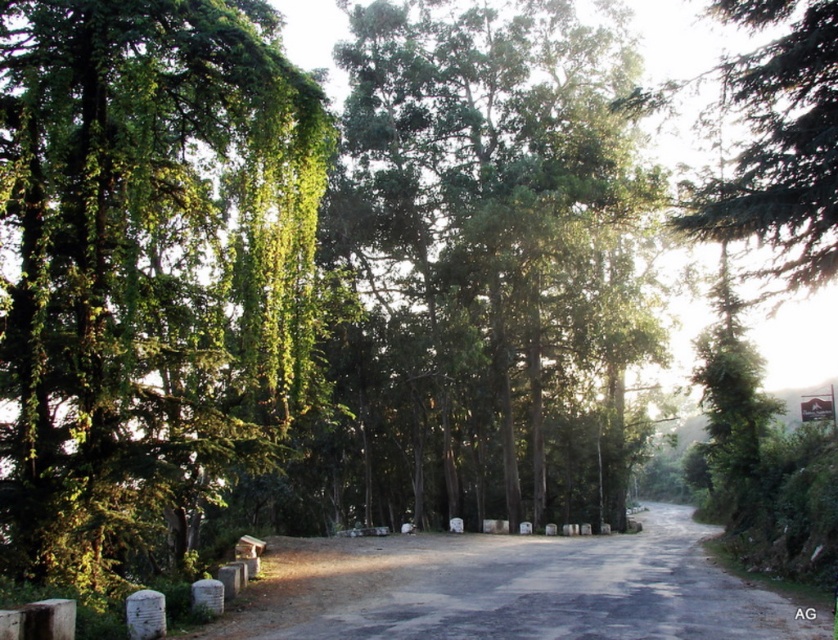
Question: Does green leafy tree at left have a larger size compared to green leafy trees at center?

Choices:
 (A) no
 (B) yes

Answer: (A)

Question: Considering the relative positions of green leafy tree at left and green leafy trees at center in the image provided, where is green leafy tree at left located with respect to green leafy trees at center?

Choices:
 (A) left
 (B) right

Answer: (A)

Question: Which of the following is the farthest from the observer?

Choices:
 (A) green leafy trees at center
 (B) green leafy tree at left

Answer: (A)

Question: Does green leafy tree at left have a lesser width compared to green leafy trees at center?

Choices:
 (A) no
 (B) yes

Answer: (B)

Question: Which of the following is the closest to the observer?

Choices:
 (A) green leafy trees at center
 (B) green leafy tree at left

Answer: (B)